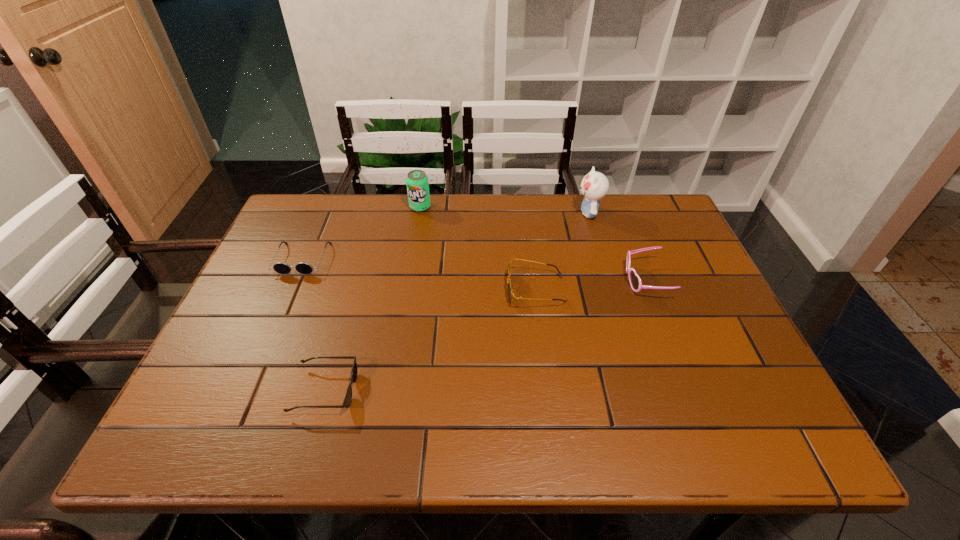
Find the location of a particular element. kitten is located at coordinates (594, 186).

In order to click on the fifth object from left to right in this screenshot , I will do 594,186.

The image size is (960, 540). Identify the location of the second tallest object. (417, 183).

Image resolution: width=960 pixels, height=540 pixels. What are the coordinates of `the third object from left to right` in the screenshot? It's located at (417, 183).

Where is `the rightmost object`? This screenshot has height=540, width=960. the rightmost object is located at coordinates pos(635,281).

The height and width of the screenshot is (540, 960). What are the coordinates of `the fourth object from left to right` in the screenshot? It's located at (510, 286).

Find the location of `the leftmost object`. the leftmost object is located at coordinates (280, 267).

Identify the location of the third sunglasses from right to left. This screenshot has width=960, height=540. (347, 401).

Locate an element on the screen. The height and width of the screenshot is (540, 960). the nearest sunglasses is located at coordinates (347, 401).

Image resolution: width=960 pixels, height=540 pixels. In order to click on vacant space situated 0.320m on the front-facing side of the kitten in this screenshot , I will do `click(470, 213)`.